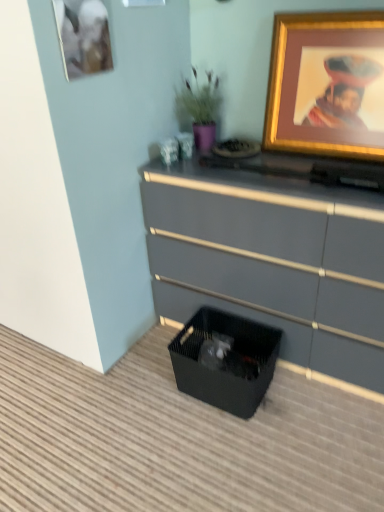
Find the location of a particular element. free location in front of black mesh storage box at lower center is located at coordinates (232, 447).